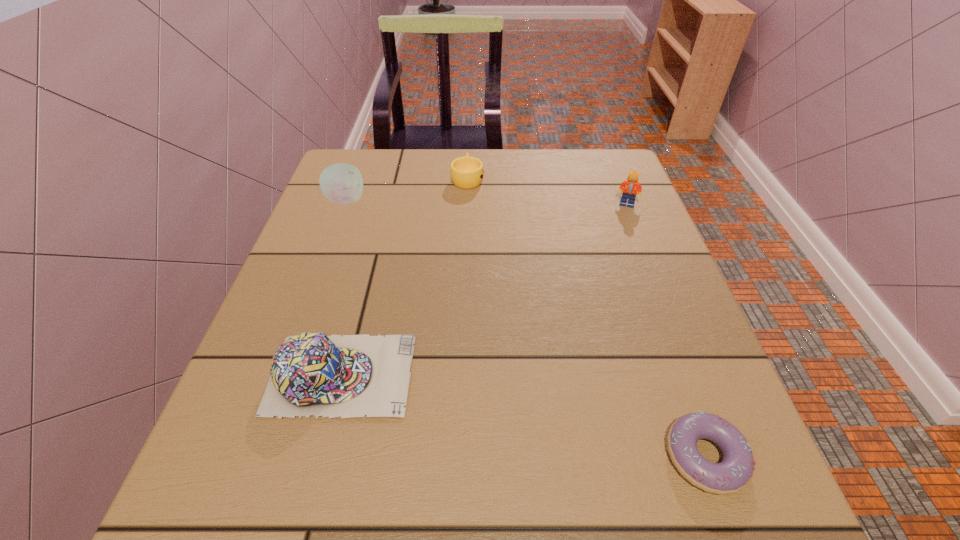
Where is `free space between the second shortest object and the Lego`? free space between the second shortest object and the Lego is located at coordinates (547, 192).

Image resolution: width=960 pixels, height=540 pixels. Find the location of `blank region between the apple and the shortest object`. blank region between the apple and the shortest object is located at coordinates (525, 329).

Identify the location of free space that is in between the doughnut and the Lego. The image size is (960, 540). (666, 330).

This screenshot has height=540, width=960. In order to click on empty space that is in between the Lego and the doughnut in this screenshot , I will do `click(666, 330)`.

Locate an element on the screen. The height and width of the screenshot is (540, 960). vacant space that's between the apple and the third tallest object is located at coordinates (344, 287).

Where is `free space that is in between the cup and the Lego`? The width and height of the screenshot is (960, 540). free space that is in between the cup and the Lego is located at coordinates (547, 192).

Select which object appears as the fourth closest to the Lego. Please provide its 2D coordinates. Your answer should be formatted as a tuple, i.e. [(x, y)], where the tuple contains the x and y coordinates of a point satisfying the conditions above.

[(342, 183)]

Where is `the fourth closest object to the fourth tallest object`? This screenshot has width=960, height=540. the fourth closest object to the fourth tallest object is located at coordinates (735, 471).

You are a GUI agent. You are given a task and a screenshot of the screen. Output one action in this format:
    pyautogui.click(x=<x>, y=<y>)
    Task: Click on the free space that satisfies the following two spatial constraints: 1. on the front side of the third object from right to left; 2. on the front, side, and top of the cap
    Image resolution: width=960 pixels, height=540 pixels.
    Given the screenshot: What is the action you would take?
    pyautogui.click(x=460, y=374)

Find the location of a particular element. free space that satisfies the following two spatial constraints: 1. on the front side of the third object from left to right; 2. on the front, side, and top of the cap is located at coordinates (460, 374).